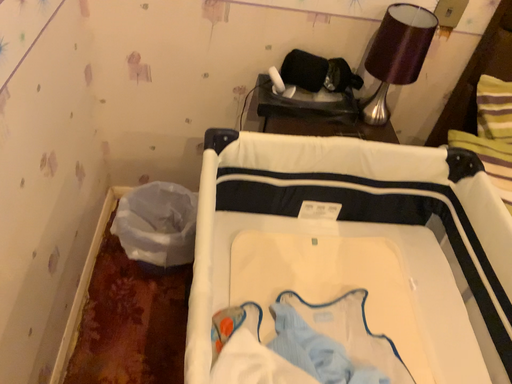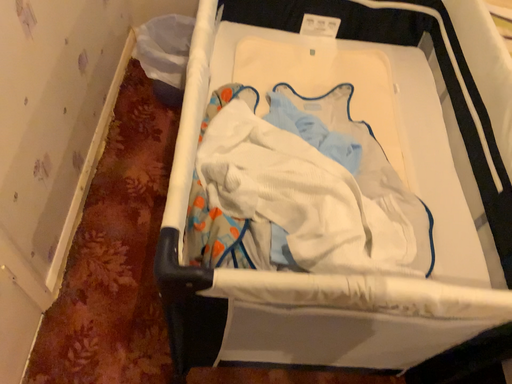
Question: How did the camera likely rotate when shooting the video?

Choices:
 (A) rotated downward
 (B) rotated upward

Answer: (A)